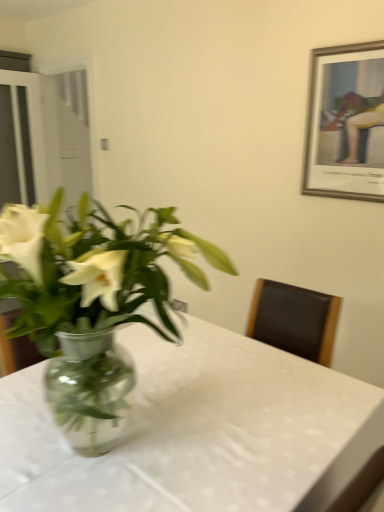
Where is `vacant point above transparent glass table at center (from a real-world perspective)`? vacant point above transparent glass table at center (from a real-world perspective) is located at coordinates (190, 402).